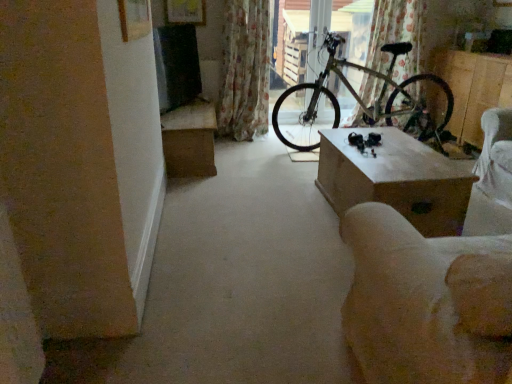
What do you see at coordinates (376, 99) in the screenshot?
I see `green metallic bicycle at center` at bounding box center [376, 99].

I want to click on green metallic bicycle at center, so (376, 99).

The height and width of the screenshot is (384, 512). I want to click on wooden box at right, so click(473, 88).

Considering the relative positions of wooden box at right and wooden table at center, placed as the first table when sorted from front to back, in the image provided, is wooden box at right to the left of wooden table at center, placed as the first table when sorted from front to back, from the viewer's perspective?

No.

Image resolution: width=512 pixels, height=384 pixels. In order to click on furniture that is behind the wooden table at center, placed as the first table when sorted from front to back in this screenshot , I will do [x=473, y=88].

From a real-world perspective, which is physically below, wooden box at right or wooden table at center, which appears as the 1th table when viewed from the right?

From a 3D spatial view, wooden table at center, which appears as the 1th table when viewed from the right, is below.

Which of these two, beige fabric armchair at lower right or wooden box at right, is bigger?

beige fabric armchair at lower right is bigger.

Is beige fabric armchair at lower right in front of or behind wooden box at right in the image?

Clearly, beige fabric armchair at lower right is in front of wooden box at right.

From the image's perspective, does beige fabric armchair at lower right appear higher than wooden box at right?

No, from the image's perspective, beige fabric armchair at lower right is not over wooden box at right.

Are beige fabric armchair at lower right and wooden box at right beside each other?

There is a gap between beige fabric armchair at lower right and wooden box at right.

Which object is positioned more to the left, green metallic bicycle at center or beige fabric armchair at lower right?

beige fabric armchair at lower right.

Looking at this image, which of these two, green metallic bicycle at center or beige fabric armchair at lower right, is bigger?

green metallic bicycle at center is bigger.

Are green metallic bicycle at center and beige fabric armchair at lower right located far from each other?

Indeed, green metallic bicycle at center is not near beige fabric armchair at lower right.

Between point (399, 291) and point (234, 95), which one is positioned in front?

Point (399, 291)

From the image's perspective, relative to floral fabric curtain at center, marked as the first curtain in a left-to-right arrangement, is beige fabric armchair at lower right above or below?

Clearly, from the image's perspective, beige fabric armchair at lower right is below floral fabric curtain at center, marked as the first curtain in a left-to-right arrangement.

Considering the relative sizes of beige fabric armchair at lower right and floral fabric curtain at center, marked as the first curtain in a left-to-right arrangement, in the image provided, is beige fabric armchair at lower right smaller than floral fabric curtain at center, marked as the first curtain in a left-to-right arrangement,?

Incorrect, beige fabric armchair at lower right is not smaller in size than floral fabric curtain at center, marked as the first curtain in a left-to-right arrangement.

Is point (206, 164) more distant than point (349, 14)?

That is False.

Based on the photo, from a real-world perspective, is brown cardboard box at left, which is the first table in left-to-right order, located higher than metallic bicycle at center?

No, from a real-world perspective, brown cardboard box at left, which is the first table in left-to-right order, is not above metallic bicycle at center.

Considering the relative sizes of brown cardboard box at left, acting as the second table starting from the front, and metallic bicycle at center in the image provided, is brown cardboard box at left, acting as the second table starting from the front, taller than metallic bicycle at center?

Incorrect, the height of brown cardboard box at left, acting as the second table starting from the front, is not larger of that of metallic bicycle at center.

Considering the relative positions of wooden table at center, the 2th table viewed from the back, and brown cardboard box at left, placed as the first table when sorted from back to front, in the image provided, is wooden table at center, the 2th table viewed from the back, to the left or to the right of brown cardboard box at left, placed as the first table when sorted from back to front,?

wooden table at center, the 2th table viewed from the back, is positioned on brown cardboard box at left, placed as the first table when sorted from back to front,'s right side.

Could you measure the distance between wooden table at center, the second table in the left-to-right sequence, and brown cardboard box at left, placed as the 2th table when sorted from right to left?

The distance of wooden table at center, the second table in the left-to-right sequence, from brown cardboard box at left, placed as the 2th table when sorted from right to left, is 1.28 meters.

From a real-world perspective, is wooden table at center, placed as the first table when sorted from front to back, physically located above or below brown cardboard box at left, placed as the 2th table when sorted from right to left?

Clearly, from a real-world perspective, wooden table at center, placed as the first table when sorted from front to back, is below brown cardboard box at left, placed as the 2th table when sorted from right to left.

Who is bigger, wooden table at center, placed as the first table when sorted from front to back, or brown cardboard box at left, acting as the second table starting from the front?

brown cardboard box at left, acting as the second table starting from the front.

From a real-world perspective, which is physically below, floral fabric curtain at upper center, the first curtain positioned from the right, or floral fabric curtain at center, marked as the 2th curtain in a right-to-left arrangement?

floral fabric curtain at center, marked as the 2th curtain in a right-to-left arrangement, from a real-world perspective.

In the image, is floral fabric curtain at upper center, the second curtain from the left, on the left side or the right side of floral fabric curtain at center, marked as the 2th curtain in a right-to-left arrangement?

Clearly, floral fabric curtain at upper center, the second curtain from the left, is on the right of floral fabric curtain at center, marked as the 2th curtain in a right-to-left arrangement, in the image.

Is floral fabric curtain at upper center, the first curtain positioned from the right, not close to floral fabric curtain at center, marked as the first curtain in a left-to-right arrangement?

floral fabric curtain at upper center, the first curtain positioned from the right, is far away from floral fabric curtain at center, marked as the first curtain in a left-to-right arrangement.

What's the angular difference between floral fabric curtain at upper center, the first curtain positioned from the right, and floral fabric curtain at center, marked as the 2th curtain in a right-to-left arrangement,'s facing directions?

1.2 degrees.

Locate an element on the screen. The width and height of the screenshot is (512, 384). the 2nd table below the wooden box at right (from a real-world perspective) is located at coordinates (395, 179).

Where is `armchair in front of the wooden box at right`? The height and width of the screenshot is (384, 512). armchair in front of the wooden box at right is located at coordinates (423, 305).

When comparing their distances from wooden box at right, does metallic bicycle at center or green metallic bicycle at center seem further?

Based on the image, metallic bicycle at center appears to be further to wooden box at right.

Estimate the real-world distances between objects in this image. Which object is further from wooden table at center, the 2th table viewed from the back, floral fabric curtain at upper center, the second curtain from the left, or floral fabric curtain at center, marked as the first curtain in a left-to-right arrangement?

Based on the image, floral fabric curtain at center, marked as the first curtain in a left-to-right arrangement, appears to be further to wooden table at center, the 2th table viewed from the back.

From the image, which object appears to be farther from beige fabric armchair at lower right, wooden table at center, placed as the first table when sorted from front to back, or brown cardboard box at left, placed as the first table when sorted from back to front?

brown cardboard box at left, placed as the first table when sorted from back to front, lies further to beige fabric armchair at lower right than the other object.

From the image, which object appears to be nearer to floral fabric curtain at upper center, the first curtain positioned from the right, beige fabric armchair at lower right or brown cardboard box at left, placed as the first table when sorted from back to front?

Based on the image, brown cardboard box at left, placed as the first table when sorted from back to front, appears to be nearer to floral fabric curtain at upper center, the first curtain positioned from the right.

Which object lies further to the anchor point beige fabric armchair at lower right, wooden table at center, which appears as the 1th table when viewed from the right, or floral fabric curtain at center, marked as the first curtain in a left-to-right arrangement?

Based on the image, floral fabric curtain at center, marked as the first curtain in a left-to-right arrangement, appears to be further to beige fabric armchair at lower right.

Estimate the real-world distances between objects in this image. Which object is further from wooden table at center, the 2th table viewed from the back, floral fabric curtain at center, marked as the 2th curtain in a right-to-left arrangement, or green metallic bicycle at center?

floral fabric curtain at center, marked as the 2th curtain in a right-to-left arrangement.

Estimate the real-world distances between objects in this image. Which object is closer to brown cardboard box at left, placed as the 2th table when sorted from right to left, floral fabric curtain at upper center, the second curtain from the left, or wooden table at center, placed as the first table when sorted from front to back?

Among the two, wooden table at center, placed as the first table when sorted from front to back, is located nearer to brown cardboard box at left, placed as the 2th table when sorted from right to left.

Estimate the real-world distances between objects in this image. Which object is closer to wooden table at center, placed as the first table when sorted from front to back, brown cardboard box at left, placed as the 2th table when sorted from right to left, or beige fabric armchair at lower right?

beige fabric armchair at lower right.

Identify the location of window screen located between floral fabric curtain at center, marked as the 2th curtain in a right-to-left arrangement, and green metallic bicycle at center in the left-right direction. (298, 44).

You are a GUI agent. You are given a task and a screenshot of the screen. Output one action in this format:
    pyautogui.click(x=<x>, y=<y>)
    Task: Click on the curtain between green metallic bicycle at center and wooden box at right
    The height and width of the screenshot is (384, 512).
    Given the screenshot: What is the action you would take?
    pyautogui.click(x=396, y=35)

Locate an element on the screen. bicycle between beige fabric armchair at lower right and floral fabric curtain at upper center, the second curtain from the left, along the z-axis is located at coordinates (376, 99).

At what (x,y) coordinates should I click in order to perform the action: click on curtain situated between metallic bicycle at center and wooden box at right from left to right. Please return your answer as a coordinate pair (x, y). The height and width of the screenshot is (384, 512). Looking at the image, I should click on click(396, 35).